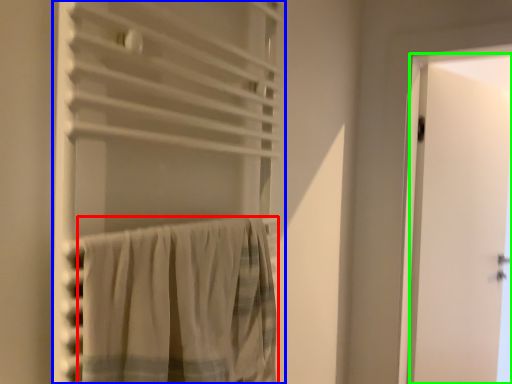
Question: Estimate the real-world distances between objects in this image. Which object is farther from curtain (highlighted by a red box), curtain (highlighted by a blue box) or door (highlighted by a green box)?

Choices:
 (A) curtain
 (B) door

Answer: (B)